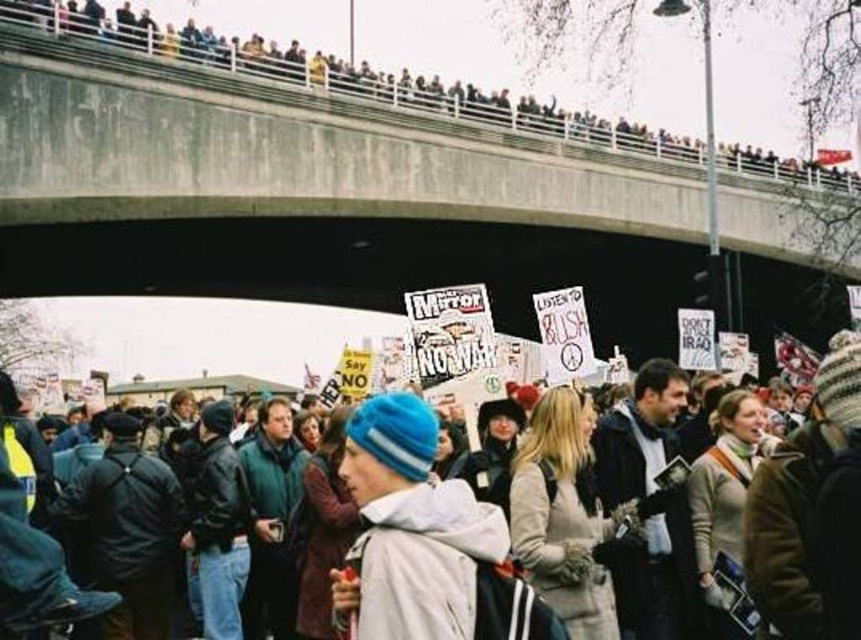
You are a photographer trying to capture a clear shot of the blue knit cap at center without the concrete bridge at upper center blocking it. What should you do?

The blue knit cap at center is behind the concrete bridge at upper center, so you should move your position to the left or right to get a clear view around the bridge.

You are a photographer standing at the edge of the crowd. You want to capture a photo that includes both the concrete bridge at upper center and the blue knit cap at center. Based on their sizes in the image, which object should you focus on first to ensure both are in frame?

The concrete bridge at upper center might be wider than blue knit cap at center, so you should focus on the concrete bridge at upper center first to ensure both are in frame.